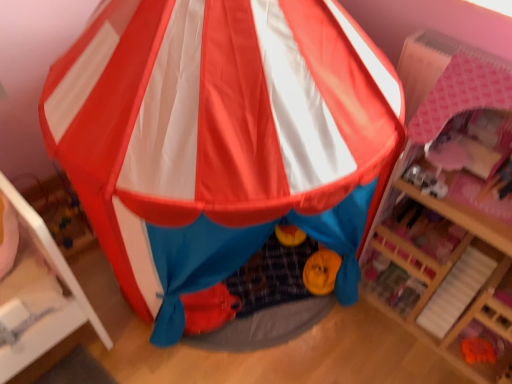
Question: Considering the positions of pink wood dollhouse at right and matte plastic tent at center in the image, is pink wood dollhouse at right bigger or smaller than matte plastic tent at center?

Choices:
 (A) small
 (B) big

Answer: (A)

Question: From the image's perspective, is pink wood dollhouse at right located above or below matte plastic tent at center?

Choices:
 (A) below
 (B) above

Answer: (A)

Question: Is pink wood dollhouse at right wider or thinner than matte plastic tent at center?

Choices:
 (A) wide
 (B) thin

Answer: (B)

Question: Choose the correct answer: Is matte plastic tent at center inside pink wood dollhouse at right or outside it?

Choices:
 (A) inside
 (B) outside

Answer: (B)

Question: From a real-world perspective, is matte plastic tent at center positioned above or below pink wood dollhouse at right?

Choices:
 (A) below
 (B) above

Answer: (B)

Question: Relative to pink wood dollhouse at right, is matte plastic tent at center in front or behind?

Choices:
 (A) front
 (B) behind

Answer: (A)

Question: Is point (69, 119) closer or farther from the camera than point (482, 246)?

Choices:
 (A) closer
 (B) farther

Answer: (A)